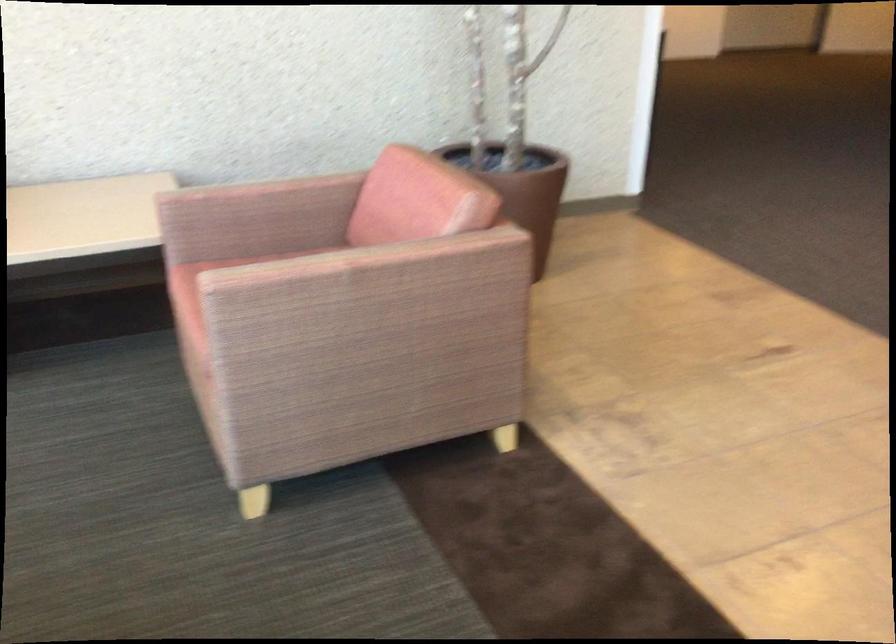
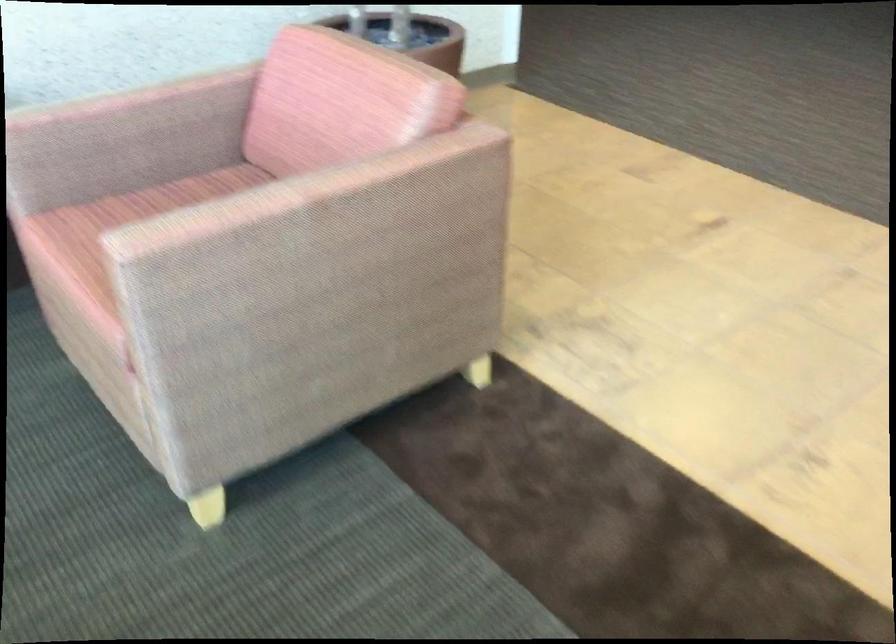
In the second image, find the point that corresponds to point (259, 185) in the first image.

(121, 98)